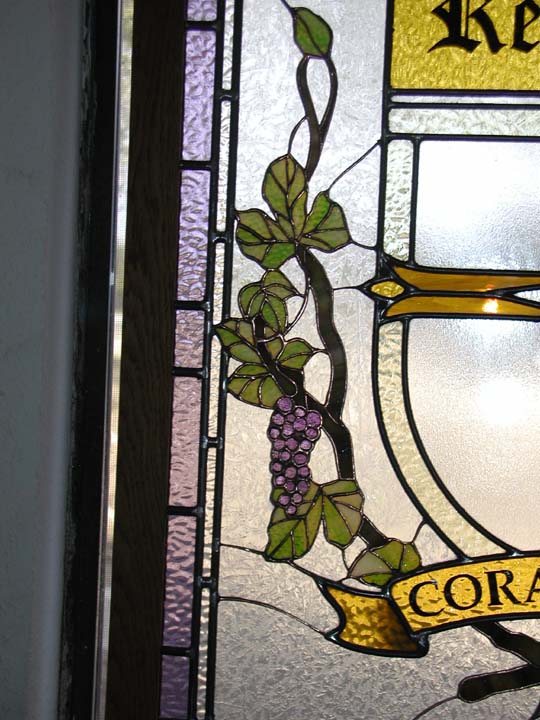
Identify the location of wall. The image size is (540, 720). (33, 211).